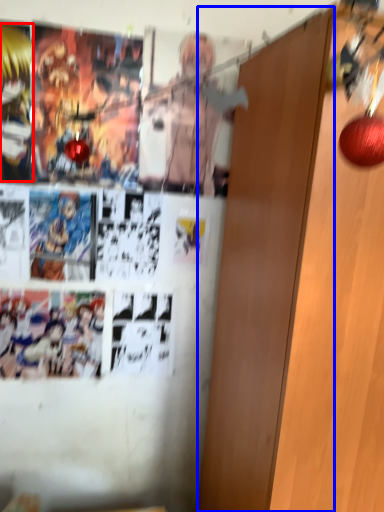
Question: Among these objects, which one is farthest to the camera, person (highlighted by a red box) or door (highlighted by a blue box)?

Choices:
 (A) person
 (B) door

Answer: (A)